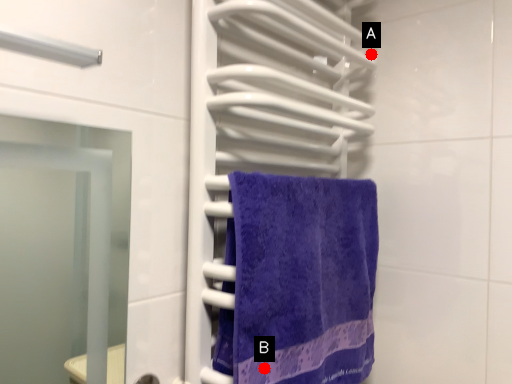
Question: Two points are circled on the image, labeled by A and B beside each circle. Which of the following is the closest to the observer?

Choices:
 (A) A is closer
 (B) B is closer

Answer: (B)